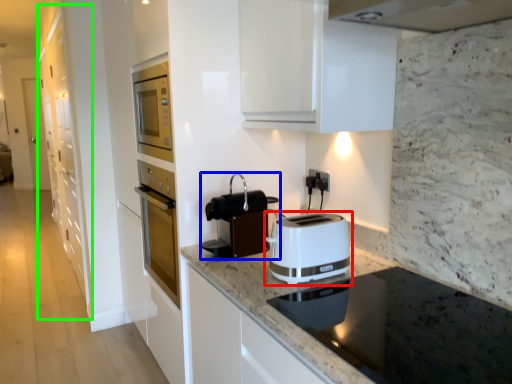
Question: Which object is positioned farthest from toaster (highlighted by a red box)? Select from kitchen appliance (highlighted by a blue box) and cabinetry (highlighted by a green box).

Choices:
 (A) kitchen appliance
 (B) cabinetry

Answer: (B)